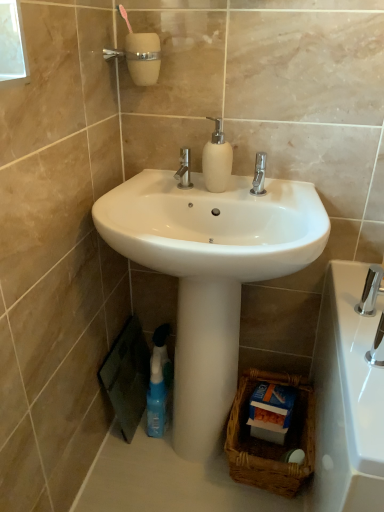
Question: Is point (213, 160) closer or farther from the camera than point (377, 339)?

Choices:
 (A) closer
 (B) farther

Answer: (B)

Question: Is matte white soap dispenser at center inside or outside of polished chrome faucet at lower right?

Choices:
 (A) outside
 (B) inside

Answer: (A)

Question: Which is farther from the white glossy pedestal at center?

Choices:
 (A) polished chrome tap at lower right
 (B) brown woven basket at lower right
 (C) matte white soap dispenser at center
 (D) white glossy sink at center
 (E) blue plastic spray bottle at lower left

Answer: (C)

Question: Which object is positioned closest to the polished chrome faucet at lower right?

Choices:
 (A) matte white soap dispenser at center
 (B) white glossy pedestal at center
 (C) blue plastic spray bottle at lower left
 (D) polished chrome tap at lower right
 (E) brown woven basket at lower right

Answer: (D)